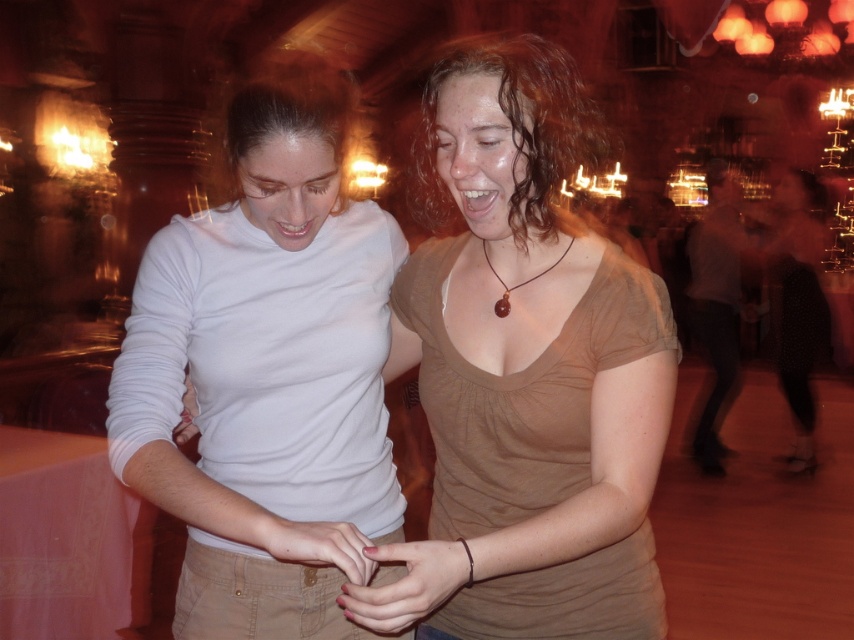
You are at a dance event and see the matte brown shirt at center and the matte white hand at lower left. Which object is closer to you?

The matte brown shirt at center is closer to you because it is in front of the matte white hand at lower left.

You are organizing a clothing donation drive and need to categorize shirts by size. You have two shirts in front of you, the matte brown shirt at center and the smooth white shirt at upper left. Which shirt should you place in the large size bin?

The matte brown shirt at center has a larger size compared to the smooth white shirt at upper left, so it should be placed in the large size bin.